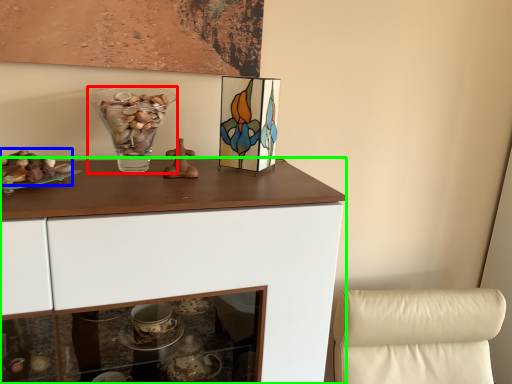
Question: Considering the real-world distances, which object is farthest from vase (highlighted by a red box)? stuff (highlighted by a blue box) or cabinetry (highlighted by a green box)?

Choices:
 (A) stuff
 (B) cabinetry

Answer: (B)